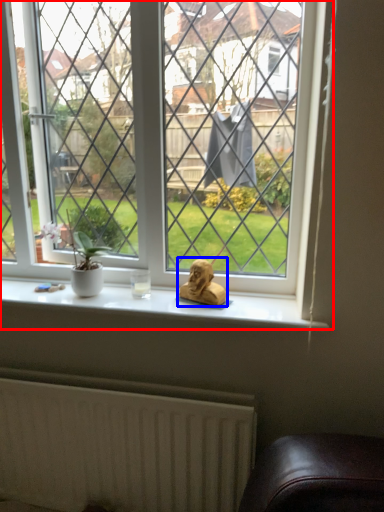
Question: Which object is further to the camera taking this photo, window (highlighted by a red box) or animal (highlighted by a blue box)?

Choices:
 (A) window
 (B) animal

Answer: (B)